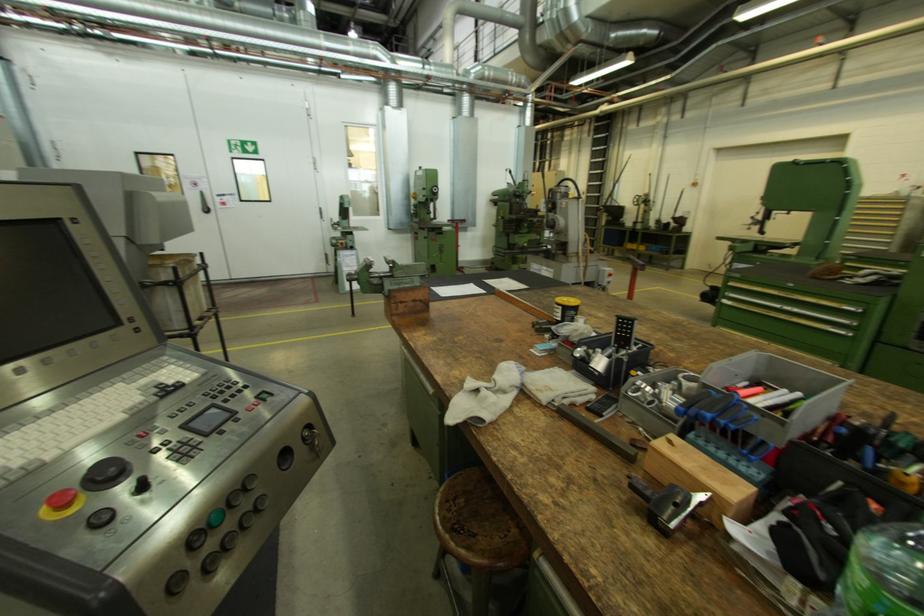
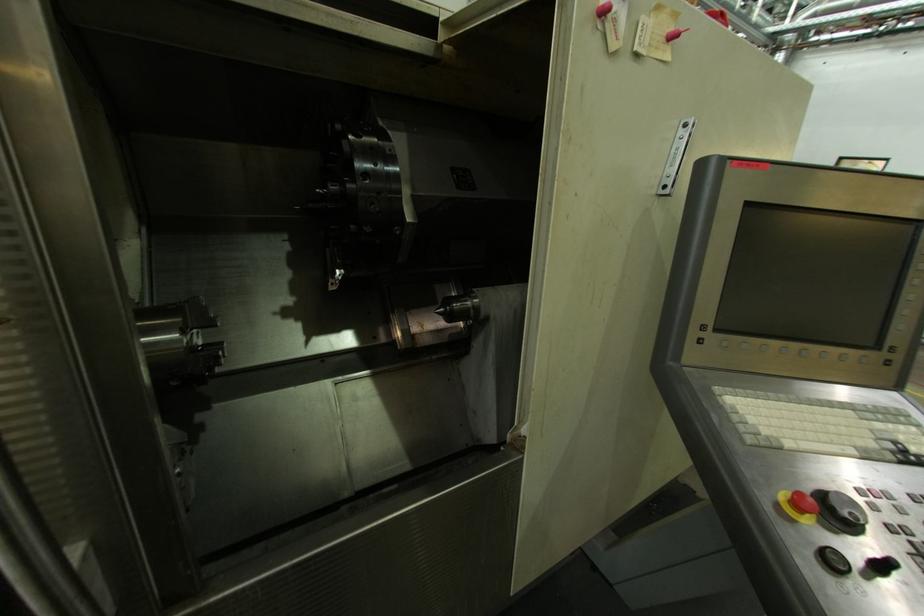
The first image is from the beginning of the video and the second image is from the end. How did the camera likely rotate when shooting the video?

The rotation direction of the camera is left-down.